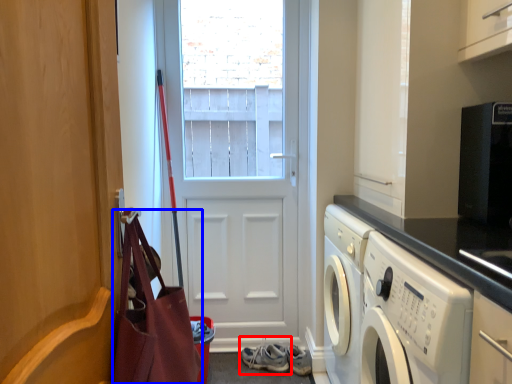
Question: Among these objects, which one is nearest to the camera, footwear (highlighted by a red box) or bag (highlighted by a blue box)?

Choices:
 (A) footwear
 (B) bag

Answer: (B)